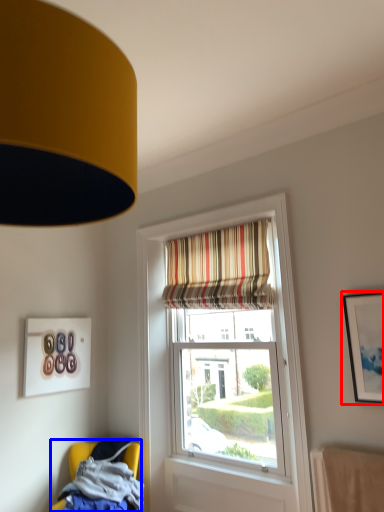
Question: Which object is closer to the camera taking this photo, picture frame (highlighted by a red box) or chair (highlighted by a blue box)?

Choices:
 (A) picture frame
 (B) chair

Answer: (A)